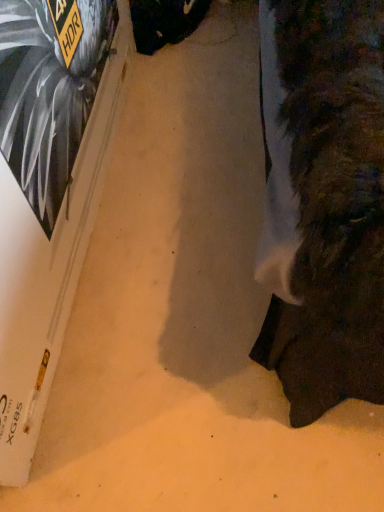
The width and height of the screenshot is (384, 512). I want to click on white cardboard box at upper left, so click(48, 195).

Describe the element at coordinates (48, 195) in the screenshot. I see `white cardboard box at upper left` at that location.

In order to face white cardboard box at upper left, should I rotate leftwards or rightwards?

You should look left and rotate roughly 20.370 degrees.

Identify the location of white cardboard box at upper left. This screenshot has height=512, width=384. (48, 195).